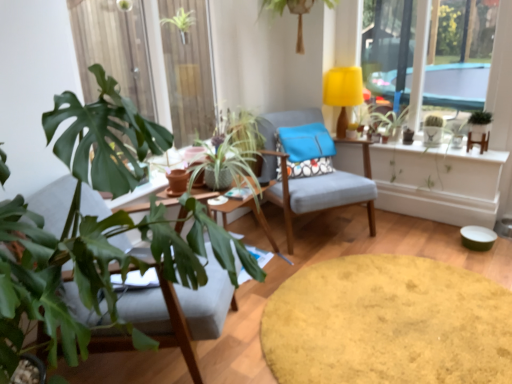
Question: Is green matte cactus at upper right, which is counted as the fourth houseplant, starting from the left, taller or shorter than green matte plant at upper right?

Choices:
 (A) tall
 (B) short

Answer: (B)

Question: Based on their positions, is green matte cactus at upper right, which ranks as the second houseplant in right-to-left order, located to the left or right of green matte plant at upper right?

Choices:
 (A) left
 (B) right

Answer: (B)

Question: Estimate the real-world distances between objects in this image. Which object is farther from the matte gray chair at center, the second chair from the right?

Choices:
 (A) velvet yellow rug at center, placed as the 2th round table when sorted from top to bottom
 (B) green matte plant at upper right
 (C) green leafy plant at upper center, the 1th houseplant in the left-to-right sequence
 (D) green leafy plant at upper center, which appears as the third houseplant when viewed from the left
 (E) yellow fabric lampshade at upper right

Answer: (E)

Question: Which is nearer to the green matte plant at right, which is counted as the fifth houseplant, starting from the left?

Choices:
 (A) blue fabric pillow at center
 (B) yellow fabric lampshade at upper right
 (C) matte gray chair at center, placed as the first chair when sorted from back to front
 (D) velvet yellow rug at center, the first round table positioned from the bottom
 (E) green leafy plant at left

Answer: (B)